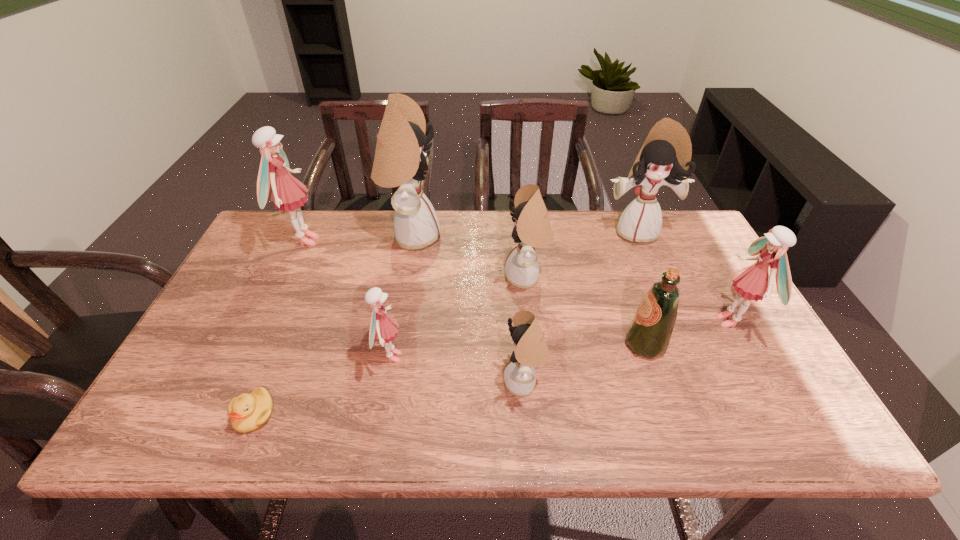
What are the coordinates of `vacant space situated at the front face of the third biggest black doll` in the screenshot? It's located at (480, 277).

Identify the location of free space located 0.110m on the front-facing side of the olive oil. (580, 345).

The width and height of the screenshot is (960, 540). Identify the location of vacant region located 0.160m on the front-facing side of the olive oil. (560, 345).

Where is `free location located on the front-facing side of the olive oil`? The width and height of the screenshot is (960, 540). free location located on the front-facing side of the olive oil is located at coordinates (576, 345).

Where is `blank area located on the front-facing side of the second pink doll from left to right`? The image size is (960, 540). blank area located on the front-facing side of the second pink doll from left to right is located at coordinates (483, 357).

Locate an element on the screen. free space located at the front face of the smallest black doll is located at coordinates (377, 382).

Locate an element on the screen. vacant space located 0.370m at the front face of the smallest black doll is located at coordinates (343, 382).

The width and height of the screenshot is (960, 540). I want to click on free space located at the front face of the smallest black doll, so click(360, 382).

The height and width of the screenshot is (540, 960). What are the coordinates of `doll that is at the near edge` in the screenshot? It's located at pyautogui.click(x=531, y=350).

Image resolution: width=960 pixels, height=540 pixels. Identify the location of duckling that is at the near edge. (248, 412).